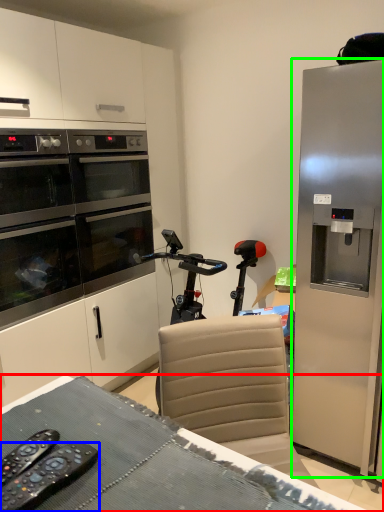
Question: Which is nearer to the desk (highlighted by a red box)? remote control (highlighted by a blue box) or refrigerator (highlighted by a green box).

Choices:
 (A) remote control
 (B) refrigerator

Answer: (A)